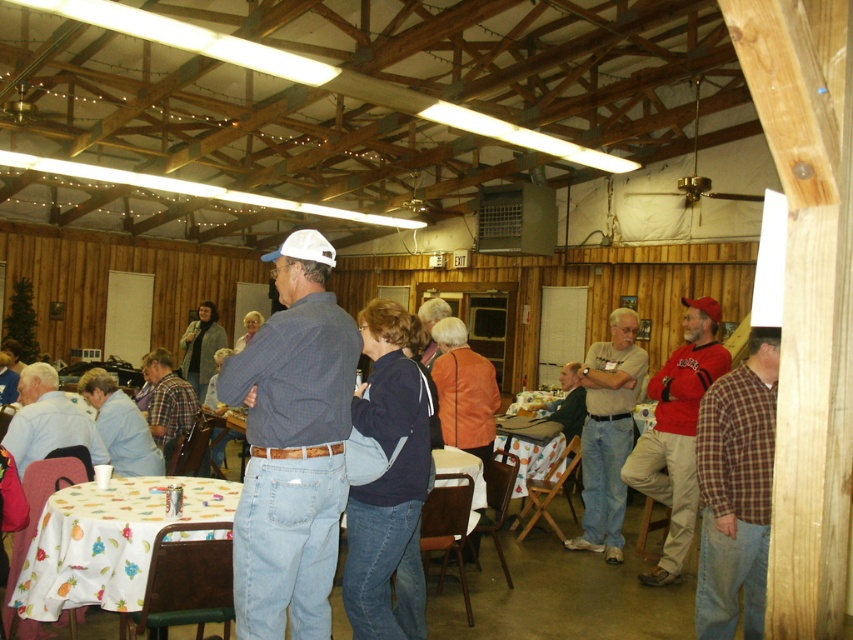
You are at a social gathering and notice two people wearing a light brown shirt at center and a plaid shirt at center. Which one is positioned to the right?

The light brown shirt at center is to the right of the plaid shirt at center.

In the scene shown: You are at the gathering and need to decide which shirt to wear for a quick photo. The light brown shirt at center and the plaid shirt at center are both available. Which one would you choose if you want a slimmer look?

The light brown shirt at center is thinner than the plaid shirt at center, so choosing the light brown shirt at center would provide a slimmer look.